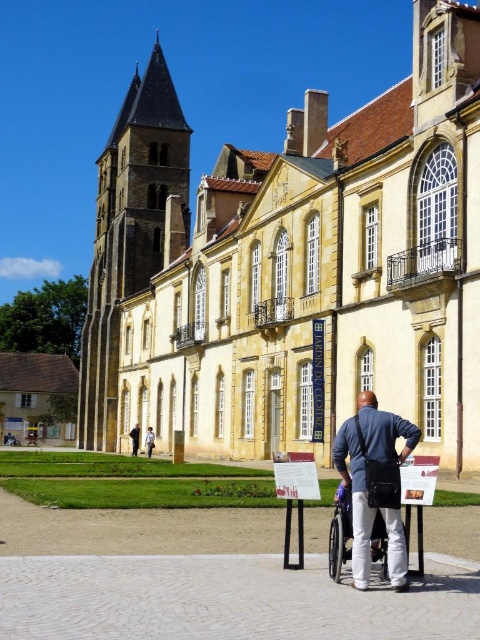
You are standing in front of the historic building complex and notice the brown wooden house at lower left and the blue shirt at center. Which object is bigger in size?

The brown wooden house at lower left is larger in size compared to the blue shirt at center.